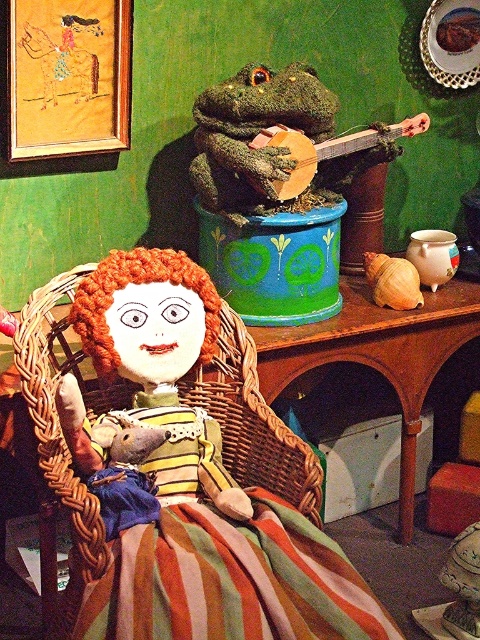
Between wooden table at center and wooden banjo at upper center, which one has more height?

Standing taller between the two is wooden table at center.

What do you see at coordinates (376, 355) in the screenshot? I see `wooden table at center` at bounding box center [376, 355].

The height and width of the screenshot is (640, 480). Find the location of `wooden table at center`. wooden table at center is located at coordinates (376, 355).

Image resolution: width=480 pixels, height=640 pixels. Describe the element at coordinates (69, 76) in the screenshot. I see `gold fabric picture frame at upper left` at that location.

Does gold fabric picture frame at upper left have a larger size compared to wooden table at center?

No, gold fabric picture frame at upper left is not bigger than wooden table at center.

Image resolution: width=480 pixels, height=640 pixels. I want to click on gold fabric picture frame at upper left, so click(x=69, y=76).

Between woven wicker basket at center and green fuzzy frog at upper center, which one appears on the left side from the viewer's perspective?

Positioned to the left is woven wicker basket at center.

Can you confirm if woven wicker basket at center is thinner than green fuzzy frog at upper center?

No.

Image resolution: width=480 pixels, height=640 pixels. What are the coordinates of `woven wicker basket at center` in the screenshot? It's located at (54, 420).